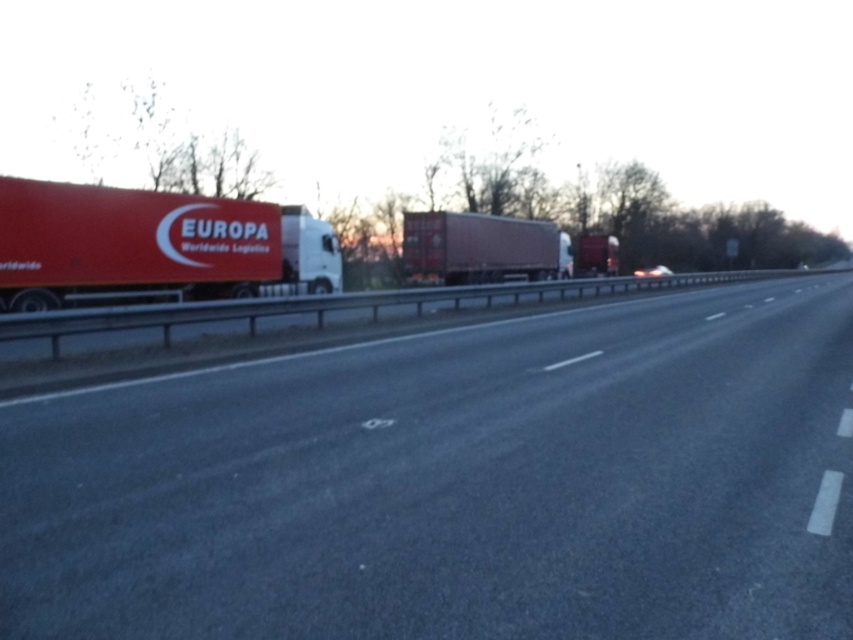
Question: Is smooth asphalt highway at center above matte red trailer truck at center?

Choices:
 (A) yes
 (B) no

Answer: (B)

Question: Can you confirm if matte red truck at left is positioned to the right of matte red trailer truck at center?

Choices:
 (A) yes
 (B) no

Answer: (B)

Question: Estimate the real-world distances between objects in this image. Which object is closer to the matte red truck at left?

Choices:
 (A) matte red trailer truck at center
 (B) smooth asphalt highway at center

Answer: (B)

Question: Which point appears farthest from the camera in this image?

Choices:
 (A) (223, 289)
 (B) (550, 227)
 (C) (755, 636)

Answer: (B)

Question: Which of the following is the closest to the observer?

Choices:
 (A) (573, 600)
 (B) (457, 214)

Answer: (A)

Question: Can you confirm if smooth asphalt highway at center is thinner than matte red truck at left?

Choices:
 (A) yes
 (B) no

Answer: (B)